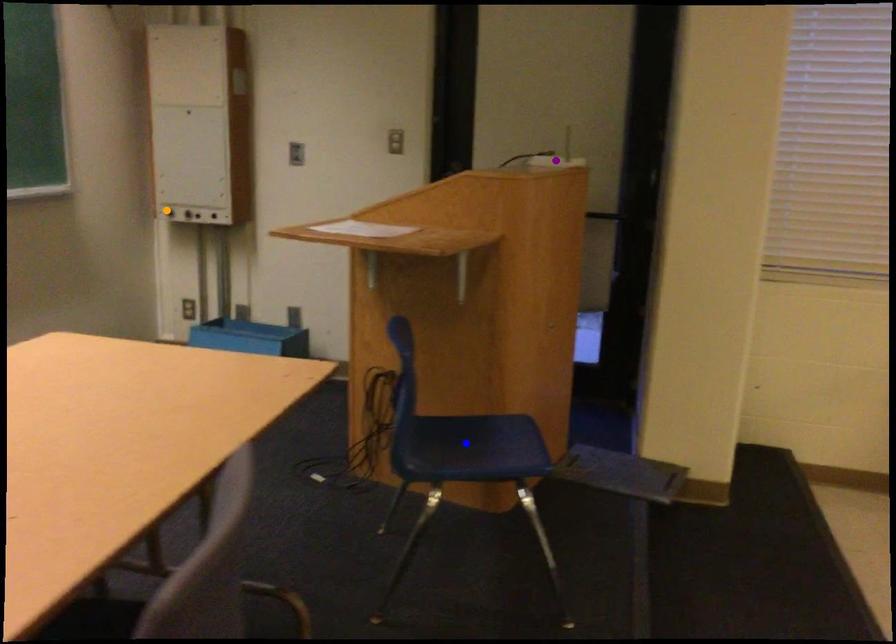
In the scene shown: Order these from nearest to farthest:
A) blue point
B) orange point
C) purple point

orange point
purple point
blue point